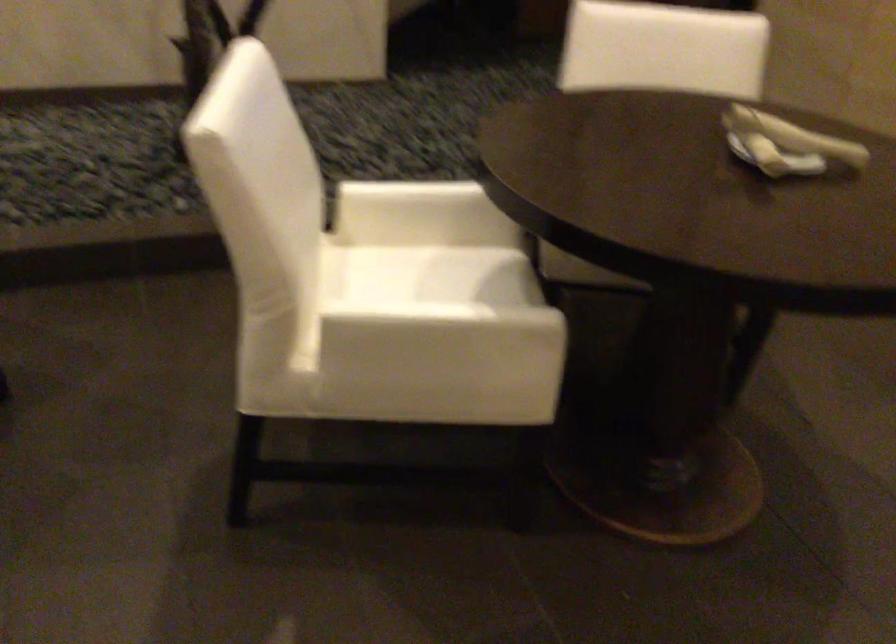
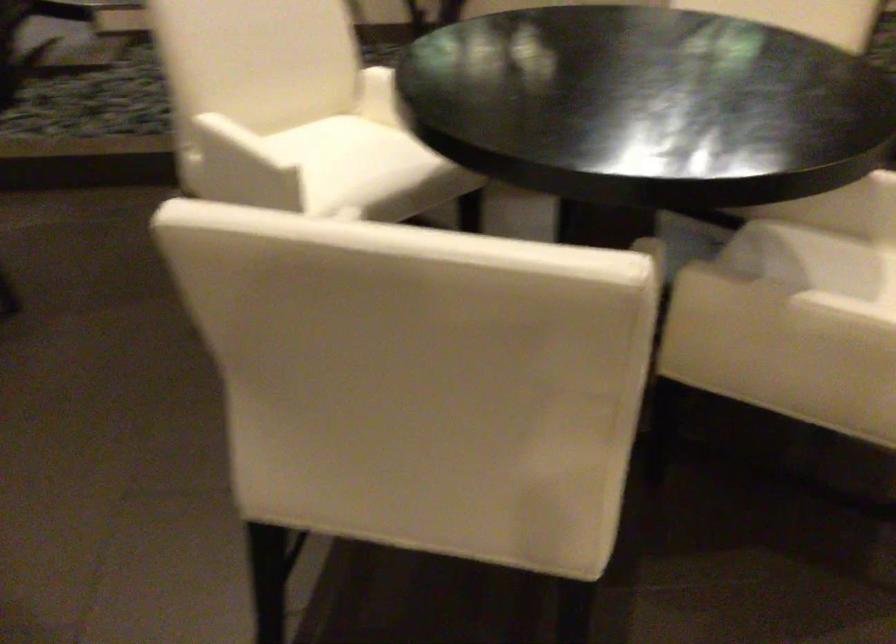
The images are taken continuously from a first-person perspective. In which direction are you moving?

The cameraman walked toward left, backward.